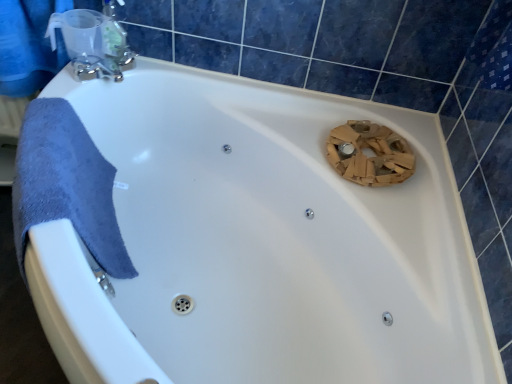
Question: From a real-world perspective, is blue fabric towel at upper left below satin nickel faucet at upper left?

Choices:
 (A) no
 (B) yes

Answer: (B)

Question: Does blue fabric towel at upper left appear on the right side of satin nickel faucet at upper left?

Choices:
 (A) yes
 (B) no

Answer: (B)

Question: Can you confirm if blue fabric towel at upper left is smaller than satin nickel faucet at upper left?

Choices:
 (A) yes
 (B) no

Answer: (B)

Question: From the image's perspective, is blue fabric towel at upper left above satin nickel faucet at upper left?

Choices:
 (A) yes
 (B) no

Answer: (A)

Question: Is blue fabric towel at upper left not inside satin nickel faucet at upper left?

Choices:
 (A) yes
 (B) no

Answer: (A)

Question: In the image, is blue fabric towel at upper left on the left side or the right side of satin nickel faucet at upper left?

Choices:
 (A) right
 (B) left

Answer: (B)

Question: Is point [0, 91] closer or farther from the camera than point [104, 8]?

Choices:
 (A) farther
 (B) closer

Answer: (A)

Question: In terms of width, does blue fabric towel at upper left look wider or thinner when compared to satin nickel faucet at upper left?

Choices:
 (A) wide
 (B) thin

Answer: (A)

Question: From the image's perspective, is blue fabric towel at upper left above or below satin nickel faucet at upper left?

Choices:
 (A) above
 (B) below

Answer: (A)

Question: From a real-world perspective, is clear plastic soap dispenser at upper left above or below satin nickel faucet at upper left?

Choices:
 (A) below
 (B) above

Answer: (B)

Question: Is clear plastic soap dispenser at upper left in front of or behind satin nickel faucet at upper left in the image?

Choices:
 (A) front
 (B) behind

Answer: (A)

Question: From their relative heights in the image, would you say clear plastic soap dispenser at upper left is taller or shorter than satin nickel faucet at upper left?

Choices:
 (A) tall
 (B) short

Answer: (A)

Question: Is point (120, 39) closer or farther from the camera than point (66, 38)?

Choices:
 (A) farther
 (B) closer

Answer: (A)

Question: Is clear plastic soap dispenser at upper left taller or shorter than blue fabric towel at upper left?

Choices:
 (A) tall
 (B) short

Answer: (B)

Question: From the image's perspective, is clear plastic soap dispenser at upper left above or below blue fabric towel at upper left?

Choices:
 (A) above
 (B) below

Answer: (A)